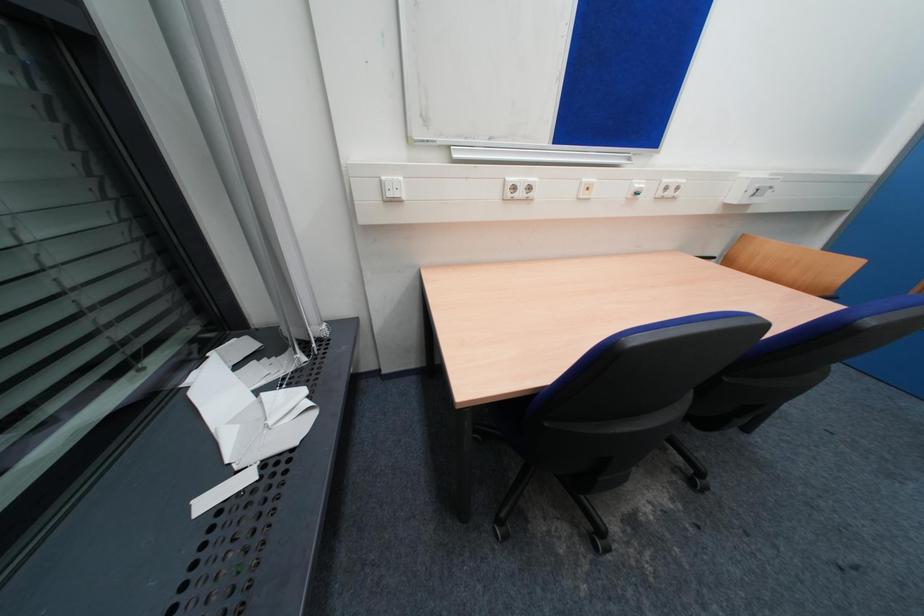
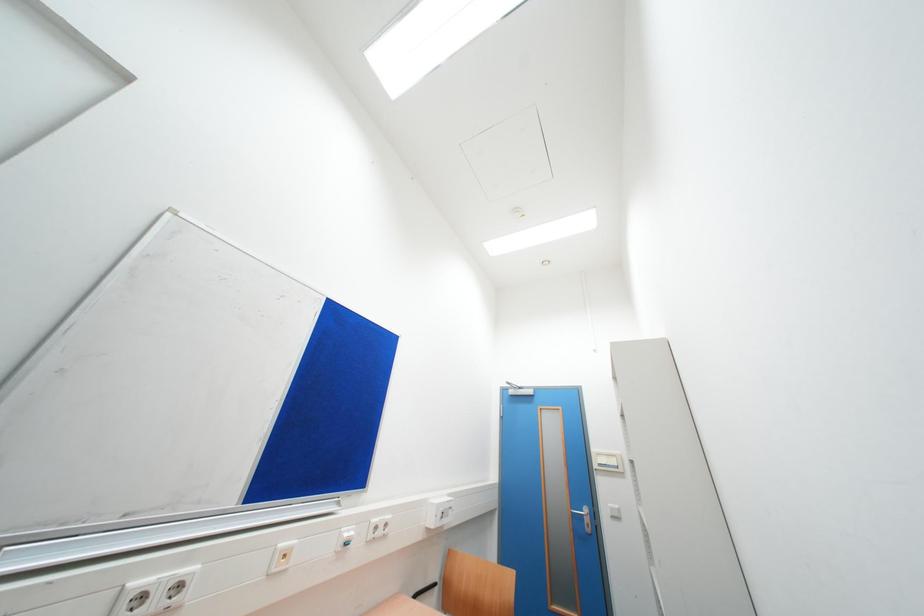
First-person continuous shooting, in which direction is the camera rotating?

The rotation direction of the camera is right-up.